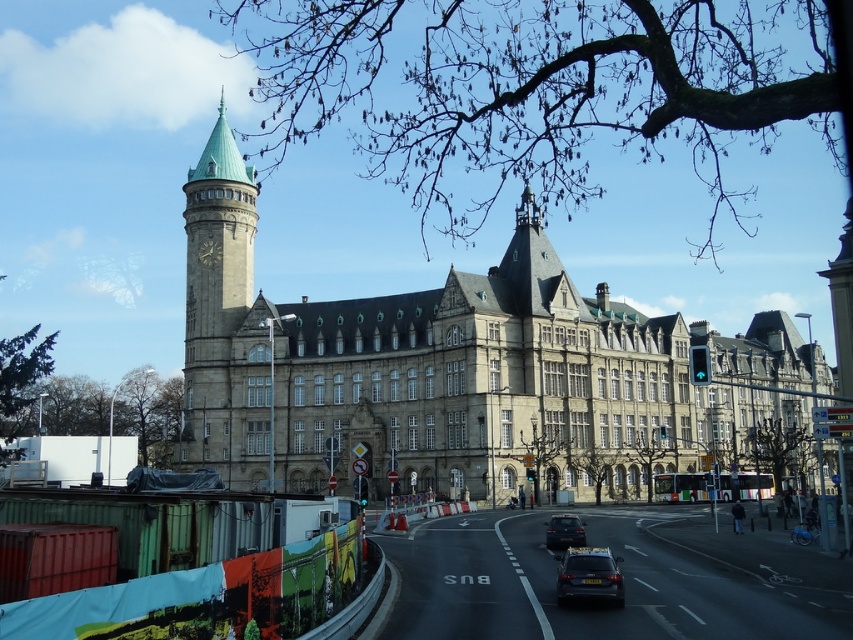
Question: Can you confirm if shiny black suv at lower center is smaller than gold metallic clock at upper left?

Choices:
 (A) yes
 (B) no

Answer: (B)

Question: Can you confirm if shiny black suv at lower center is positioned below shiny black sedan at center?

Choices:
 (A) no
 (B) yes

Answer: (A)

Question: Which of the following is the closest to the observer?

Choices:
 (A) shiny black suv at lower center
 (B) shiny black sedan at center
 (C) green copper bell tower at upper left

Answer: (A)

Question: Which of these objects is positioned closest to the shiny black sedan at center?

Choices:
 (A) green copper bell tower at upper left
 (B) shiny black suv at lower center
 (C) stone building at center
 (D) gold metallic clock at upper left

Answer: (B)

Question: Does stone building at center appear under green copper bell tower at upper left?

Choices:
 (A) no
 (B) yes

Answer: (B)

Question: Among these objects, which one is farthest from the camera?

Choices:
 (A) shiny black sedan at center
 (B) shiny black suv at lower center

Answer: (A)